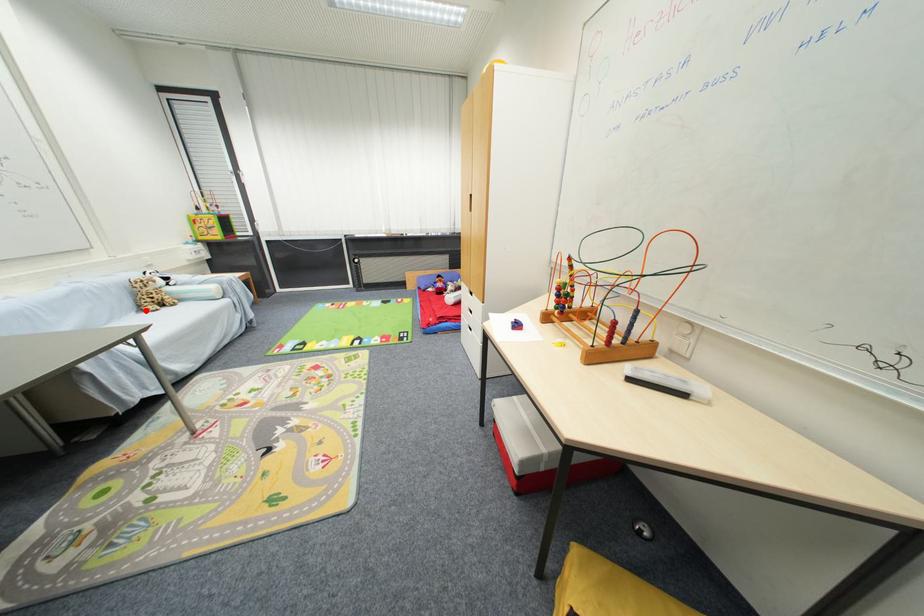
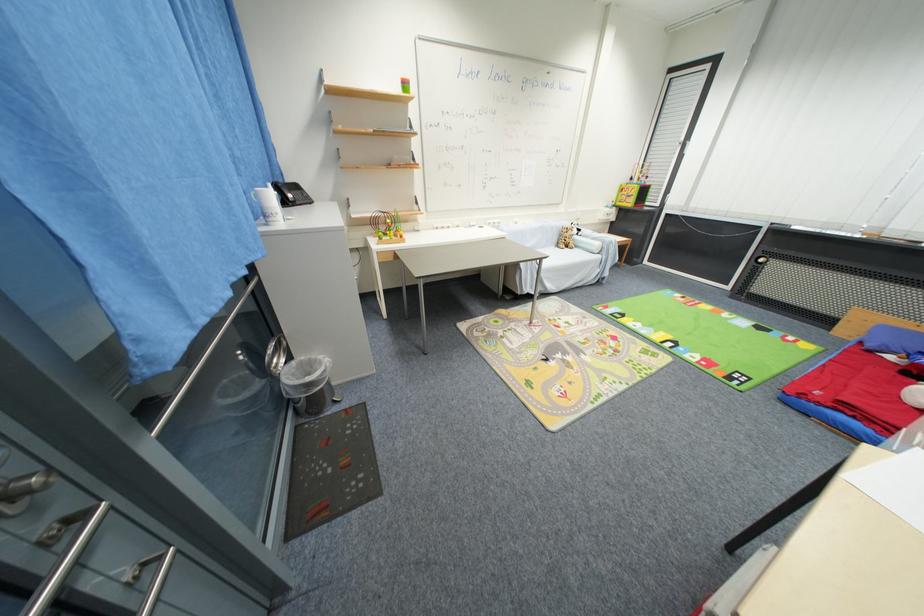
In the second image, find the point that corresponds to the highlighted location in the first image.

(563, 246)